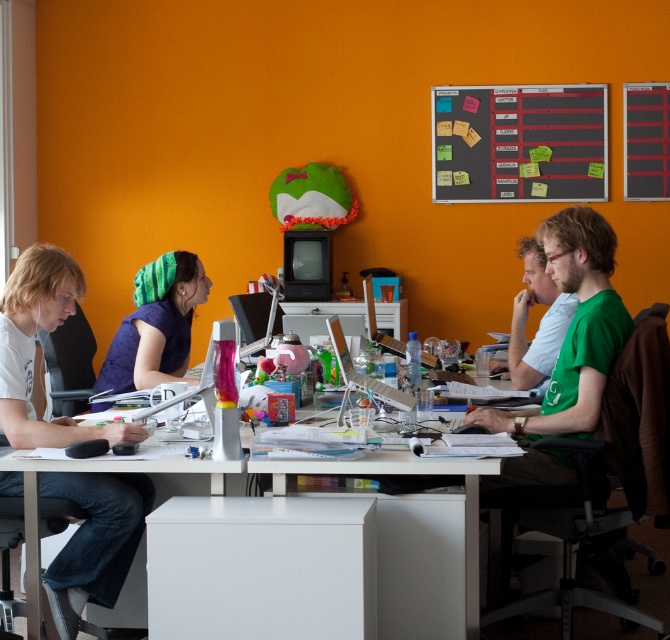
In the scene shown: Is white t-shirt at left taller than blackboard with sticky notes at upper center?

Indeed, white t-shirt at left has a greater height compared to blackboard with sticky notes at upper center.

Is white t-shirt at left to the left of blackboard with sticky notes at upper center from the viewer's perspective?

Correct, you'll find white t-shirt at left to the left of blackboard with sticky notes at upper center.

Image resolution: width=670 pixels, height=640 pixels. Describe the element at coordinates (34, 346) in the screenshot. I see `white t-shirt at left` at that location.

At what (x,y) coordinates should I click in order to perform the action: click on white t-shirt at left. Please return your answer as a coordinate pair (x, y). The height and width of the screenshot is (640, 670). Looking at the image, I should click on (34, 346).

Is green matte shirt at right thinner than green matte shirt at center?

Incorrect, green matte shirt at right's width is not less than green matte shirt at center's.

Is green matte shirt at right taller than green matte shirt at center?

Correct, green matte shirt at right is much taller as green matte shirt at center.

What do you see at coordinates (574, 330) in the screenshot? This screenshot has width=670, height=640. I see `green matte shirt at right` at bounding box center [574, 330].

The width and height of the screenshot is (670, 640). Find the location of `green matte shirt at right`. green matte shirt at right is located at coordinates (574, 330).

Between blackboard with sticky notes at upper center and green knitted headband at center, which one appears on the left side from the viewer's perspective?

From the viewer's perspective, green knitted headband at center appears more on the left side.

Can you confirm if blackboard with sticky notes at upper center is smaller than green knitted headband at center?

Indeed, blackboard with sticky notes at upper center has a smaller size compared to green knitted headband at center.

Measure the distance between blackboard with sticky notes at upper center and camera.

The distance of blackboard with sticky notes at upper center from camera is 20.10 feet.

You are a GUI agent. You are given a task and a screenshot of the screen. Output one action in this format:
    pyautogui.click(x=<x>, y=<y>)
    Task: Click on the blackboard with sticky notes at upper center
    The width and height of the screenshot is (670, 640).
    Given the screenshot: What is the action you would take?
    pyautogui.click(x=519, y=144)